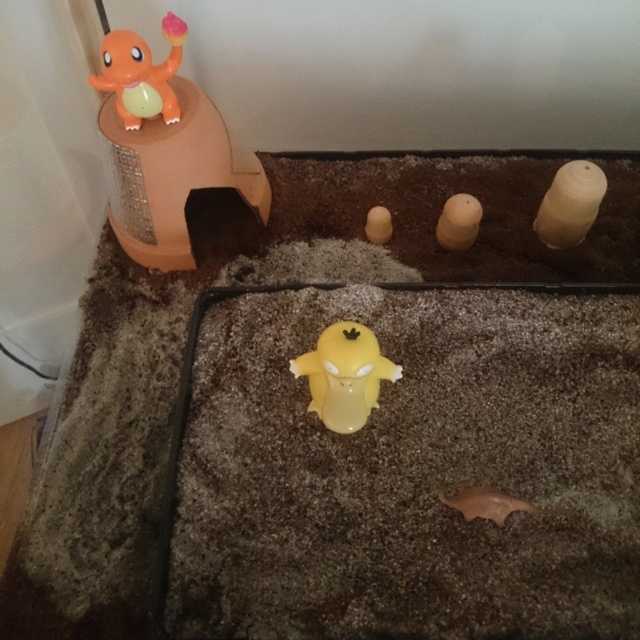
You are standing in front of a hamster enclosure and want to place a small treat exactly at point (356, 420). If your hand is currently 1 meter away from the enclosure, can you reach the point without moving closer?

The distance between point (356, 420) and the viewer is 83.53 centimeters. Since your hand is 1 meter away, you can reach the point without moving closer as 83.53 cm is less than 1 meter.

You are a small animal in the terrarium and want to reach the matte orange plastic charmander at upper left. Which direction should you move from your current position at the center of the enclosure?

The matte orange plastic charmander at upper left is located at point [140,74], so you should move towards the upper left direction from the center to reach it.